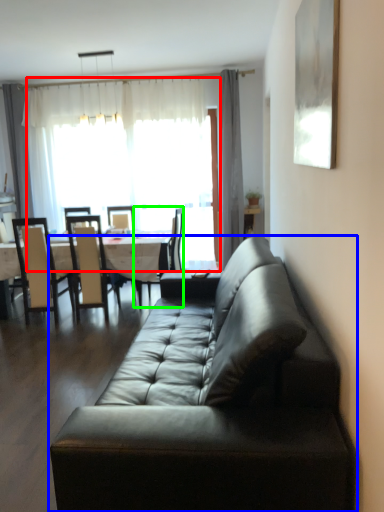
Question: Which object is the closest to the window screen (highlighted by a red box)? Choose among these: studio couch (highlighted by a blue box) or chair (highlighted by a green box).

Choices:
 (A) studio couch
 (B) chair

Answer: (B)